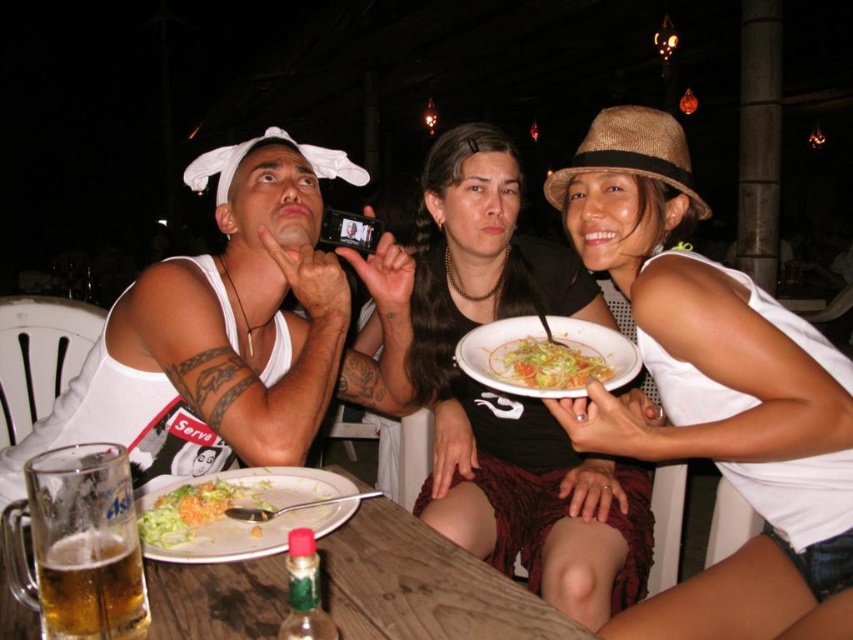
Question: Which point appears farthest from the camera in this image?

Choices:
 (A) (119, 556)
 (B) (83, 456)
 (C) (252, 497)

Answer: (C)

Question: Does white tank top at left have a smaller size compared to matte black plate at center?

Choices:
 (A) yes
 (B) no

Answer: (A)

Question: Estimate the real-world distances between objects in this image. Which object is closer to the foamy golden beer at table left?

Choices:
 (A) matte black plate at center
 (B) translucent glass mug at lower left

Answer: (B)

Question: In this image, where is white matte tank top at upper right located relative to matte black plate at center?

Choices:
 (A) left
 (B) right

Answer: (B)

Question: Which is nearer to the matte black plate at center?

Choices:
 (A) white matte plate at center
 (B) translucent glass mug at lower left
 (C) white ceramic plate at center

Answer: (A)

Question: Can you confirm if white tank top at left is positioned to the right of white matte plate at center?

Choices:
 (A) no
 (B) yes

Answer: (A)